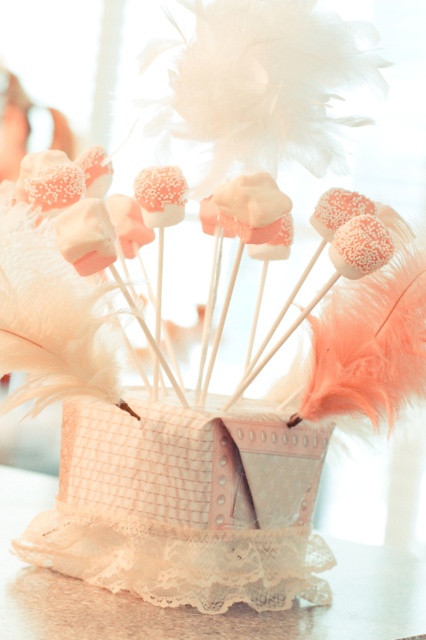
Question: Which point is closer to the camera?

Choices:
 (A) lace fabric at lower center
 (B) coral marshmallow at center

Answer: (A)

Question: Can you confirm if coral marshmallow at center is positioned above lace fabric at lower center?

Choices:
 (A) yes
 (B) no

Answer: (A)

Question: Observing the image, what is the correct spatial positioning of coral marshmallow at center in reference to lace fabric at lower center?

Choices:
 (A) right
 (B) left

Answer: (B)

Question: Among these objects, which one is nearest to the camera?

Choices:
 (A) lace fabric at lower center
 (B) coral marshmallow at center

Answer: (A)

Question: Considering the relative positions of coral marshmallow at center and lace fabric at lower center in the image provided, where is coral marshmallow at center located with respect to lace fabric at lower center?

Choices:
 (A) left
 (B) right

Answer: (A)